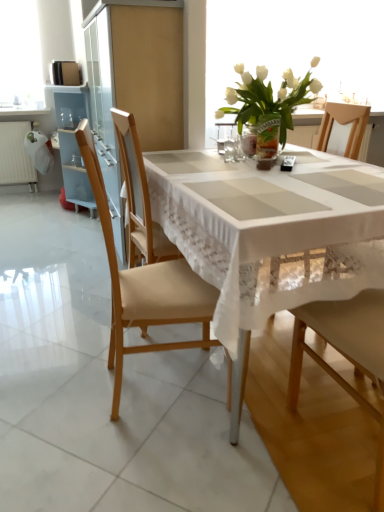
At what (x,y) coordinates should I click in order to perform the action: click on vacant space situated on the left part of translucent glass vase at center. Please return your answer as a coordinate pair (x, y). The height and width of the screenshot is (512, 384). Looking at the image, I should click on (234, 159).